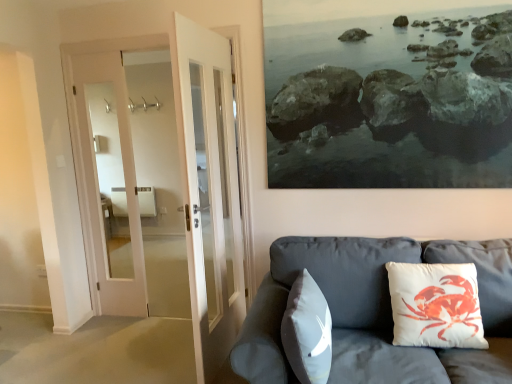
This screenshot has height=384, width=512. Find the location of `white matte pillow at center, the 1th pillow when ordered from left to right`. white matte pillow at center, the 1th pillow when ordered from left to right is located at coordinates (307, 331).

The height and width of the screenshot is (384, 512). What do you see at coordinates (435, 305) in the screenshot?
I see `white cotton cushion with crab print at right, the 1th pillow viewed from the right` at bounding box center [435, 305].

Looking at this image, in order to face white cotton cushion with crab print at right, the 1th pillow viewed from the right, should I rotate leftwards or rightwards?

It's best to rotate right around 23.126 degrees.

Locate an element on the screen. The image size is (512, 384). matte gray couch at lower right is located at coordinates (372, 310).

Locate an element on the screen. Image resolution: width=512 pixels, height=384 pixels. white matte pillow at center, acting as the second pillow starting from the right is located at coordinates (307, 331).

Are white cotton cushion with crab print at right, the 1th pillow viewed from the right, and white matte pillow at center, the 1th pillow when ordered from left to right, far apart?

No.

From a real-world perspective, is white cotton cushion with crab print at right, which is counted as the 2th pillow, starting from the left, located higher than white matte pillow at center, the 1th pillow when ordered from left to right?

Yes, from a real-world perspective, white cotton cushion with crab print at right, which is counted as the 2th pillow, starting from the left, is over white matte pillow at center, the 1th pillow when ordered from left to right

Between white cotton cushion with crab print at right, the 1th pillow viewed from the right, and white matte pillow at center, acting as the second pillow starting from the right, which one appears on the left side from the viewer's perspective?

From the viewer's perspective, white matte pillow at center, acting as the second pillow starting from the right, appears more on the left side.

From the image's perspective, which object appears higher, white cotton cushion with crab print at right, the 1th pillow viewed from the right, or white matte pillow at center, acting as the second pillow starting from the right?

white cotton cushion with crab print at right, the 1th pillow viewed from the right, from the image's perspective.

Considering the relative positions of matte gray couch at lower right and white cotton cushion with crab print at right, the 1th pillow viewed from the right, in the image provided, is matte gray couch at lower right to the right of white cotton cushion with crab print at right, the 1th pillow viewed from the right, from the viewer's perspective?

Incorrect, matte gray couch at lower right is not on the right side of white cotton cushion with crab print at right, the 1th pillow viewed from the right.

This screenshot has width=512, height=384. Identify the location of pillow that is on the right side of matte gray couch at lower right. (435, 305).

Does matte gray couch at lower right have a smaller size compared to white cotton cushion with crab print at right, which is counted as the 2th pillow, starting from the left?

No.

From a real-world perspective, who is located higher, matte gray couch at lower right or white cotton cushion with crab print at right, the 1th pillow viewed from the right?

white cotton cushion with crab print at right, the 1th pillow viewed from the right, from a real-world perspective.

Can you tell me how much white matte pillow at center, acting as the second pillow starting from the right, and matte gray couch at lower right differ in facing direction?

The angle between the facing direction of white matte pillow at center, acting as the second pillow starting from the right, and the facing direction of matte gray couch at lower right is 89.6 degrees.

Which of these two, white matte pillow at center, the 1th pillow when ordered from left to right, or matte gray couch at lower right, stands taller?

matte gray couch at lower right.

From a real-world perspective, between white matte pillow at center, acting as the second pillow starting from the right, and matte gray couch at lower right, who is vertically lower?

In real-world perspective, matte gray couch at lower right is lower.

Does white matte pillow at center, acting as the second pillow starting from the right, turn towards matte gray couch at lower right?

Yes.

From the matte gray couch at lower right, count 2nd pillows backward and point to it. Please provide its 2D coordinates.

[(435, 305)]

Is white cotton cushion with crab print at right, the 1th pillow viewed from the right, looking in the opposite direction of matte gray couch at lower right?

Correct, white cotton cushion with crab print at right, the 1th pillow viewed from the right, is looking away from matte gray couch at lower right.

How different are the orientations of white cotton cushion with crab print at right, the 1th pillow viewed from the right, and matte gray couch at lower right in degrees?

The facing directions of white cotton cushion with crab print at right, the 1th pillow viewed from the right, and matte gray couch at lower right are 1.11 degrees apart.

Is matte gray couch at lower right facing away from white matte pillow at center, the 1th pillow when ordered from left to right?

That's right, matte gray couch at lower right is facing away from white matte pillow at center, the 1th pillow when ordered from left to right.

Consider the image. Is matte gray couch at lower right bigger than white matte pillow at center, the 1th pillow when ordered from left to right?

Yes.

From a real-world perspective, which object stands above the other?

In real-world perspective, white matte pillow at center, the 1th pillow when ordered from left to right, is above.

Which object is positioned more to the right, matte gray couch at lower right or white matte pillow at center, acting as the second pillow starting from the right?

Positioned to the right is matte gray couch at lower right.

Is white matte pillow at center, the 1th pillow when ordered from left to right, thinner than white cotton cushion with crab print at right, the 1th pillow viewed from the right?

Yes.

Where is `pillow that is under the white cotton cushion with crab print at right, the 1th pillow viewed from the right (from a real-world perspective)`? pillow that is under the white cotton cushion with crab print at right, the 1th pillow viewed from the right (from a real-world perspective) is located at coordinates (307, 331).

Is white matte pillow at center, the 1th pillow when ordered from left to right, not near white cotton cushion with crab print at right, the 1th pillow viewed from the right?

white matte pillow at center, the 1th pillow when ordered from left to right, is actually quite close to white cotton cushion with crab print at right, the 1th pillow viewed from the right.

Find the location of a particular element. pillow directly beneath the white cotton cushion with crab print at right, which is counted as the 2th pillow, starting from the left (from a real-world perspective) is located at coordinates (307, 331).

There is a matte gray couch at lower right. Identify the location of the 2nd pillow above it (from the image's perspective). This screenshot has height=384, width=512. (435, 305).

Which object lies nearer to the anchor point matte gray couch at lower right, white cotton cushion with crab print at right, the 1th pillow viewed from the right, or white matte pillow at center, the 1th pillow when ordered from left to right?

Based on the image, white cotton cushion with crab print at right, the 1th pillow viewed from the right, appears to be nearer to matte gray couch at lower right.

When comparing their distances from white cotton cushion with crab print at right, the 1th pillow viewed from the right, does matte gray couch at lower right or white matte pillow at center, acting as the second pillow starting from the right, seem further?

white matte pillow at center, acting as the second pillow starting from the right, is further to white cotton cushion with crab print at right, the 1th pillow viewed from the right.

Based on their spatial positions, is white cotton cushion with crab print at right, the 1th pillow viewed from the right, or matte gray couch at lower right further from white matte pillow at center, the 1th pillow when ordered from left to right?

white cotton cushion with crab print at right, the 1th pillow viewed from the right, is further to white matte pillow at center, the 1th pillow when ordered from left to right.

From the image, which object appears to be farther from white matte pillow at center, acting as the second pillow starting from the right, matte gray couch at lower right or white cotton cushion with crab print at right, which is counted as the 2th pillow, starting from the left?

white cotton cushion with crab print at right, which is counted as the 2th pillow, starting from the left.

Which object lies nearer to the anchor point white cotton cushion with crab print at right, which is counted as the 2th pillow, starting from the left, white matte pillow at center, acting as the second pillow starting from the right, or matte gray couch at lower right?

Based on the image, matte gray couch at lower right appears to be nearer to white cotton cushion with crab print at right, which is counted as the 2th pillow, starting from the left.

Looking at the image, which one is located closer to matte gray couch at lower right, white matte pillow at center, acting as the second pillow starting from the right, or white cotton cushion with crab print at right, the 1th pillow viewed from the right?

The object closer to matte gray couch at lower right is white cotton cushion with crab print at right, the 1th pillow viewed from the right.

In order to click on studio couch between white matte pillow at center, acting as the second pillow starting from the right, and white cotton cushion with crab print at right, the 1th pillow viewed from the right, from left to right in this screenshot , I will do `click(372, 310)`.